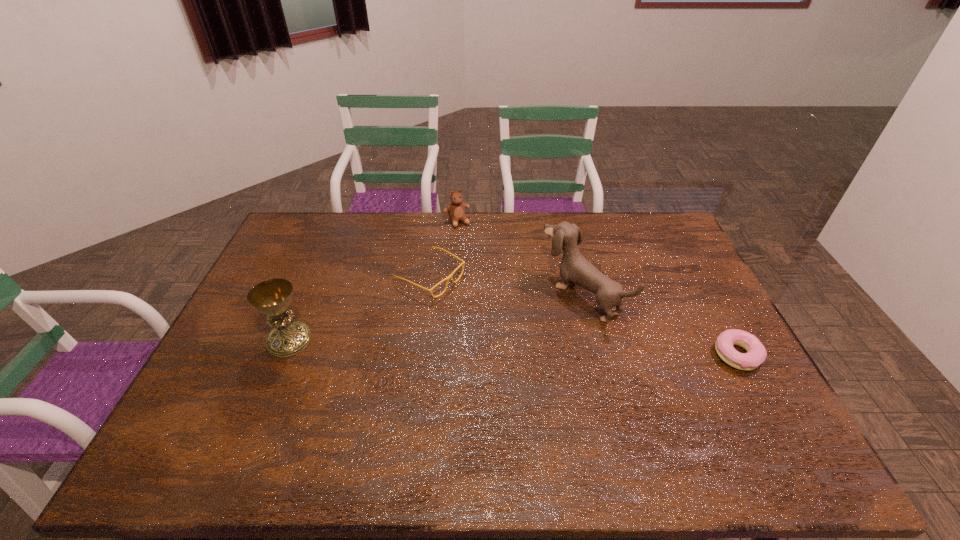
Where is `vacant space on the desktop that is between the chalice and the rightmost object and is positioned in front of the lenses of the spectacles`? The height and width of the screenshot is (540, 960). vacant space on the desktop that is between the chalice and the rightmost object and is positioned in front of the lenses of the spectacles is located at coordinates (566, 349).

You are a GUI agent. You are given a task and a screenshot of the screen. Output one action in this format:
    pyautogui.click(x=<x>, y=<y>)
    Task: Click on the vacant space on the desktop that is between the chalice and the doughnut and is positioned at the face of the second object from right to left
    
    Given the screenshot: What is the action you would take?
    pyautogui.click(x=494, y=347)

Find the location of a particular element. The height and width of the screenshot is (540, 960). free space on the desktop that is between the leftmost object and the doughnut and is positioned on the front-facing side of the third tallest object is located at coordinates (533, 348).